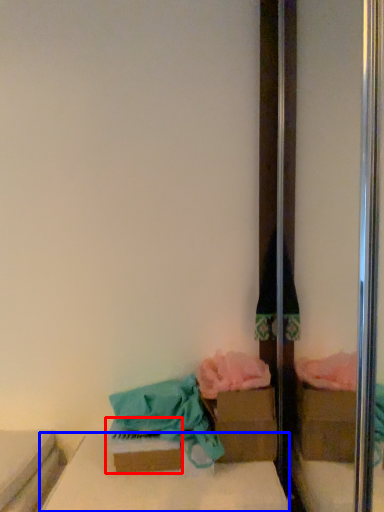
Question: Which object is closer to the camera taking this photo, cardboard box (highlighted by a red box) or furniture (highlighted by a blue box)?

Choices:
 (A) cardboard box
 (B) furniture

Answer: (B)